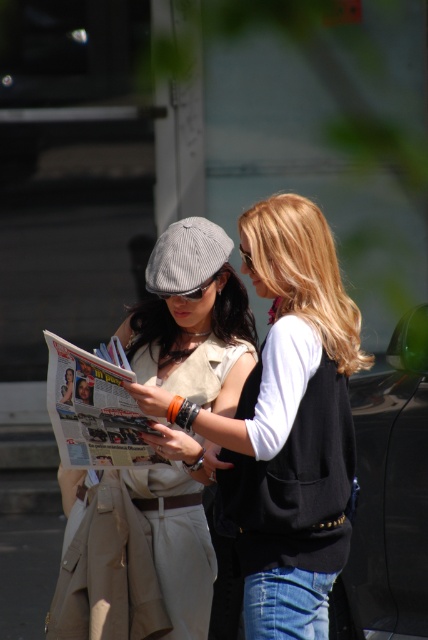
Question: Is matte gray goggles at center further to camera compared to black plastic goggles at upper center?

Choices:
 (A) no
 (B) yes

Answer: (B)

Question: Which point is farther to the camera?

Choices:
 (A) matte beige trench coat at left
 (B) black plastic goggles at upper center
 (C) matte beige trench coat at center
 (D) gray corduroy baseball cap at center

Answer: (D)

Question: Does matte beige trench coat at left appear under matte gray goggles at center?

Choices:
 (A) no
 (B) yes

Answer: (B)

Question: Which point is farther from the camera taking this photo?

Choices:
 (A) (186, 269)
 (B) (202, 252)
 (C) (324, 502)
 (D) (214, 275)

Answer: (D)

Question: Which point appears farthest from the camera in this image?

Choices:
 (A) (178, 296)
 (B) (154, 438)
 (C) (210, 275)
 (D) (250, 269)

Answer: (C)

Question: From the image, what is the correct spatial relationship of gray corduroy baseball cap at center in relation to black plastic goggles at upper center?

Choices:
 (A) right
 (B) left

Answer: (B)